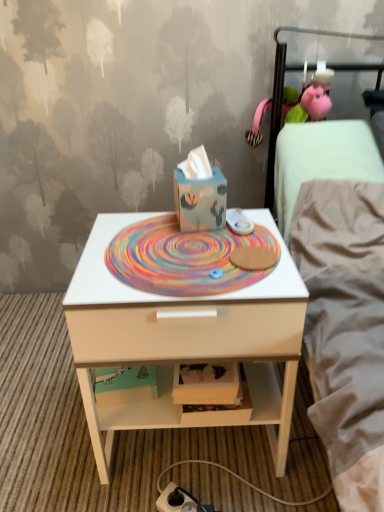
Question: Are matte blue cardboard box at center and white matte nightstand at center making contact?

Choices:
 (A) no
 (B) yes

Answer: (A)

Question: Considering the relative positions of matte blue cardboard box at center and white matte nightstand at center in the image provided, is matte blue cardboard box at center to the left of white matte nightstand at center from the viewer's perspective?

Choices:
 (A) no
 (B) yes

Answer: (A)

Question: Does matte blue cardboard box at center have a smaller size compared to white matte nightstand at center?

Choices:
 (A) no
 (B) yes

Answer: (B)

Question: From a real-world perspective, is matte blue cardboard box at center physically below white matte nightstand at center?

Choices:
 (A) yes
 (B) no

Answer: (B)

Question: Is the depth of matte blue cardboard box at center greater than that of white matte nightstand at center?

Choices:
 (A) yes
 (B) no

Answer: (A)

Question: Considering the positions of white matte nightstand at center and matte blue cardboard box at center in the image, is white matte nightstand at center bigger or smaller than matte blue cardboard box at center?

Choices:
 (A) small
 (B) big

Answer: (B)

Question: Is point (77, 373) closer or farther from the camera than point (203, 197)?

Choices:
 (A) closer
 (B) farther

Answer: (A)

Question: From a real-world perspective, is white matte nightstand at center above or below matte blue cardboard box at center?

Choices:
 (A) above
 (B) below

Answer: (B)

Question: From the image's perspective, is white matte nightstand at center positioned above or below matte blue cardboard box at center?

Choices:
 (A) below
 (B) above

Answer: (A)

Question: Would you say white matte nightstand at center is inside or outside multicolored woven mat at center?

Choices:
 (A) inside
 (B) outside

Answer: (B)

Question: Is white matte nightstand at center wider or thinner than multicolored woven mat at center?

Choices:
 (A) thin
 (B) wide

Answer: (B)

Question: From the image's perspective, is white matte nightstand at center above or below multicolored woven mat at center?

Choices:
 (A) below
 (B) above

Answer: (A)

Question: From their relative heights in the image, would you say white matte nightstand at center is taller or shorter than multicolored woven mat at center?

Choices:
 (A) short
 (B) tall

Answer: (B)

Question: Considering the positions of point (196, 280) and point (221, 197), is point (196, 280) closer or farther from the camera than point (221, 197)?

Choices:
 (A) closer
 (B) farther

Answer: (A)

Question: Is multicolored woven mat at center inside or outside of matte blue cardboard box at center?

Choices:
 (A) outside
 (B) inside

Answer: (A)